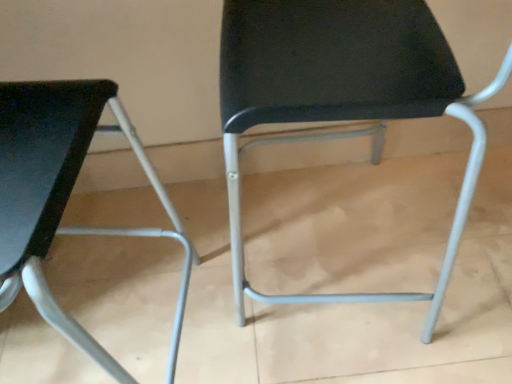
Question: In which direction should I rotate to look at black fabric chair at center, the 1th chair from the right?

Choices:
 (A) right
 (B) left

Answer: (A)

Question: Is black fabric chair at center, acting as the 2th chair starting from the left, outside matte black chair at left, which ranks as the first chair in left-to-right order?

Choices:
 (A) no
 (B) yes

Answer: (B)

Question: Is the position of black fabric chair at center, acting as the 2th chair starting from the left, more distant than that of matte black chair at left, which ranks as the first chair in left-to-right order?

Choices:
 (A) no
 (B) yes

Answer: (B)

Question: Would you say black fabric chair at center, acting as the 2th chair starting from the left, contains matte black chair at left, which ranks as the first chair in left-to-right order?

Choices:
 (A) yes
 (B) no

Answer: (B)

Question: From a real-world perspective, is black fabric chair at center, the 1th chair from the right, over matte black chair at left, the 2th chair in the right-to-left sequence?

Choices:
 (A) no
 (B) yes

Answer: (A)

Question: Is black fabric chair at center, the 1th chair from the right, to the left of matte black chair at left, the 2th chair in the right-to-left sequence, from the viewer's perspective?

Choices:
 (A) no
 (B) yes

Answer: (A)

Question: Is black fabric chair at center, acting as the 2th chair starting from the left, wider than matte black chair at left, which ranks as the first chair in left-to-right order?

Choices:
 (A) yes
 (B) no

Answer: (B)

Question: From a real-world perspective, is matte black chair at left, the 2th chair in the right-to-left sequence, under black fabric chair at center, acting as the 2th chair starting from the left?

Choices:
 (A) yes
 (B) no

Answer: (B)

Question: Is matte black chair at left, the 2th chair in the right-to-left sequence, oriented towards black fabric chair at center, the 1th chair from the right?

Choices:
 (A) no
 (B) yes

Answer: (A)

Question: Considering the relative sizes of matte black chair at left, the 2th chair in the right-to-left sequence, and black fabric chair at center, acting as the 2th chair starting from the left, in the image provided, is matte black chair at left, the 2th chair in the right-to-left sequence, wider than black fabric chair at center, acting as the 2th chair starting from the left,?

Choices:
 (A) no
 (B) yes

Answer: (B)

Question: From the image's perspective, is matte black chair at left, the 2th chair in the right-to-left sequence, below black fabric chair at center, acting as the 2th chair starting from the left?

Choices:
 (A) no
 (B) yes

Answer: (B)

Question: From a real-world perspective, is matte black chair at left, the 2th chair in the right-to-left sequence, located higher than black fabric chair at center, the 1th chair from the right?

Choices:
 (A) no
 (B) yes

Answer: (B)

Question: Considering the relative sizes of matte black chair at left, which ranks as the first chair in left-to-right order, and black fabric chair at center, the 1th chair from the right, in the image provided, is matte black chair at left, which ranks as the first chair in left-to-right order, bigger than black fabric chair at center, the 1th chair from the right,?

Choices:
 (A) no
 (B) yes

Answer: (B)

Question: From a real-world perspective, is matte black chair at left, which ranks as the first chair in left-to-right order, physically located above or below black fabric chair at center, the 1th chair from the right?

Choices:
 (A) below
 (B) above

Answer: (B)